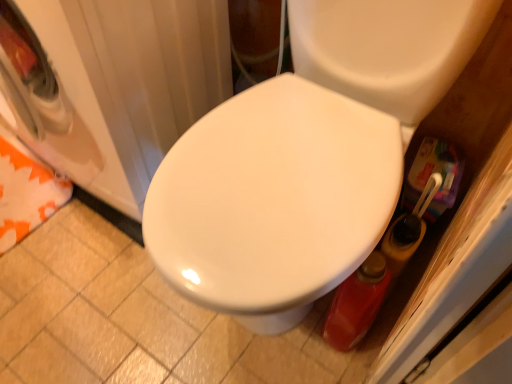
Describe the element at coordinates (116, 85) in the screenshot. The height and width of the screenshot is (384, 512). I see `white glossy washing machine at left` at that location.

Find the location of `white glossy washing machine at left`. white glossy washing machine at left is located at coordinates (116, 85).

Locate an element on the screen. This screenshot has width=512, height=384. white glossy washing machine at left is located at coordinates (116, 85).